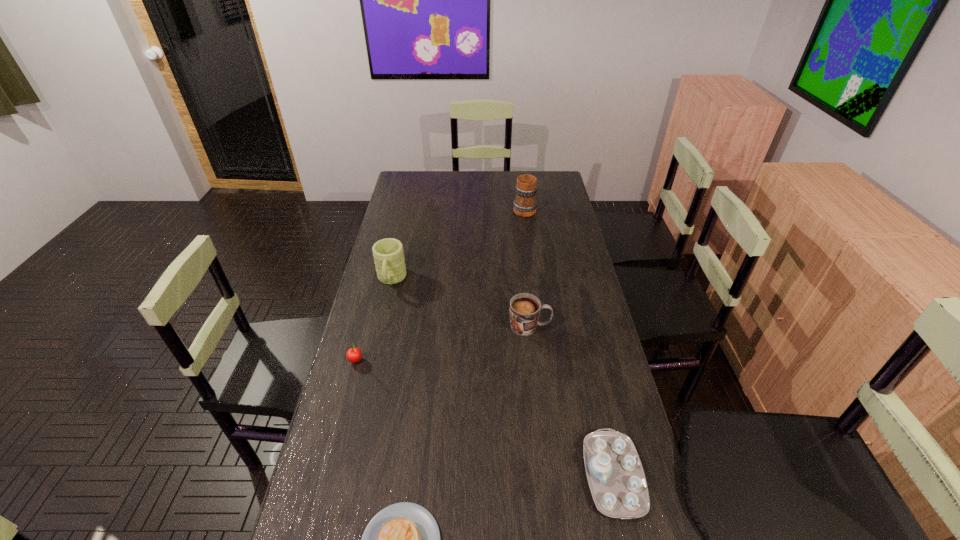
This screenshot has height=540, width=960. Identify the location of vacant space located on the side of the farthest object with the handle. (521, 190).

At what (x,y) coordinates should I click in order to perform the action: click on vacant space located 0.180m on the side of the leftmost mug with the handle. Please return your answer as a coordinate pair (x, y). Image resolution: width=960 pixels, height=540 pixels. Looking at the image, I should click on (379, 332).

Where is `vacant area located 0.150m on the side of the nearest mug with the handle`? This screenshot has width=960, height=540. vacant area located 0.150m on the side of the nearest mug with the handle is located at coordinates (596, 327).

Locate an element on the screen. free space located 0.060m on the front of the third nearest object is located at coordinates (349, 384).

At what (x,y) coordinates should I click in order to perform the action: click on vacant space positioned on the back of the rightmost object. Please return your answer as a coordinate pair (x, y). The image size is (960, 540). Looking at the image, I should click on (589, 371).

Where is `mug present at the left edge`? Image resolution: width=960 pixels, height=540 pixels. mug present at the left edge is located at coordinates (388, 253).

Locate an element on the screen. cherry that is at the left edge is located at coordinates (354, 354).

Image resolution: width=960 pixels, height=540 pixels. What are the coordinates of `mug positioned at the right edge` in the screenshot? It's located at (525, 204).

Identify the location of chinaware present at the right edge. Image resolution: width=960 pixels, height=540 pixels. (616, 478).

I want to click on free spot at the left edge of the desktop, so click(x=382, y=309).